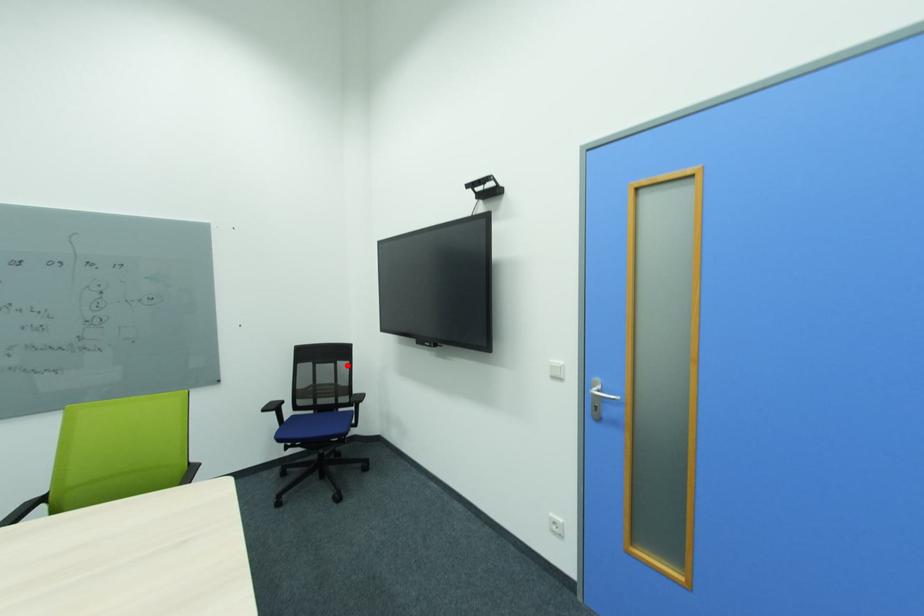
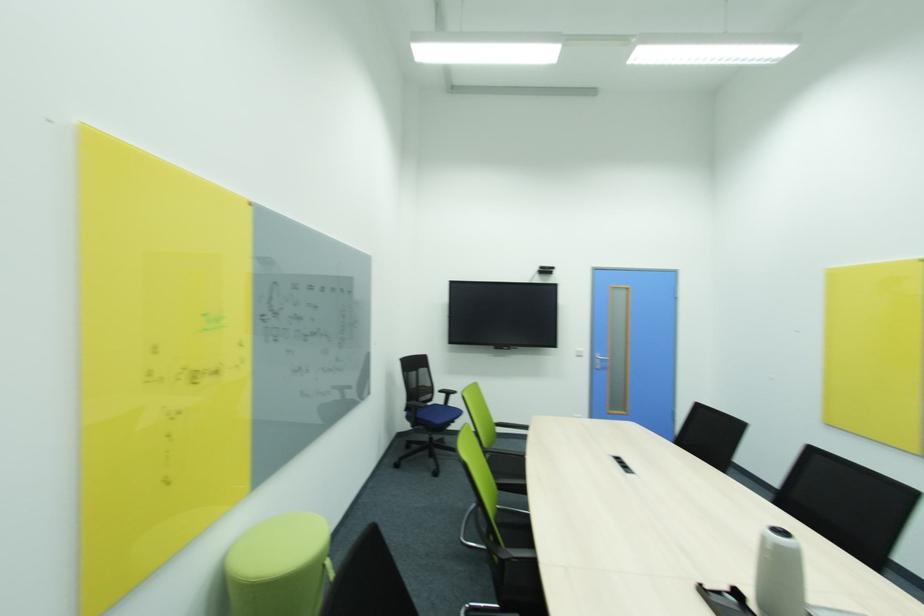
The point at the highlighted location is marked in the first image. Where is the corresponding point in the second image?

(428, 371)